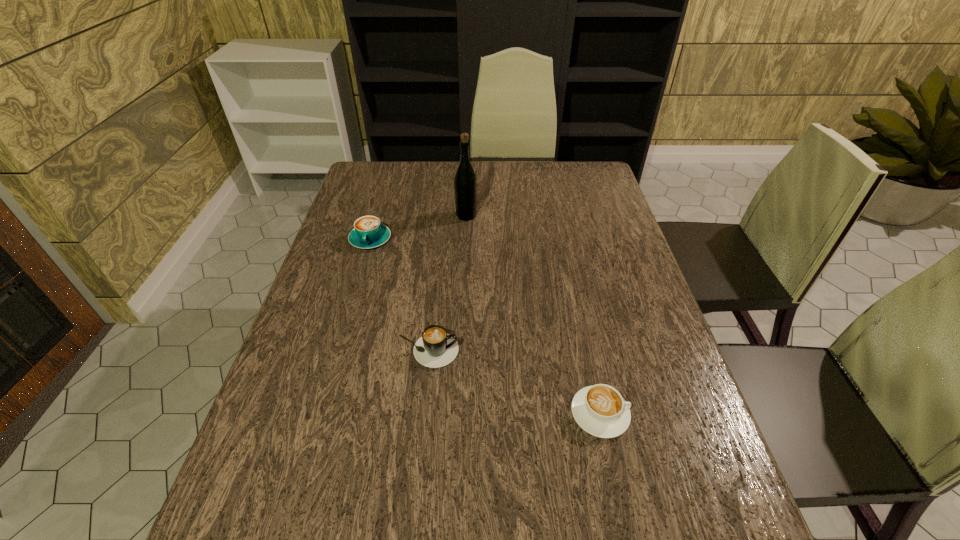
Image resolution: width=960 pixels, height=540 pixels. In order to click on cappuccino that is the nearest to the rightmost cappuccino in this screenshot , I will do `click(436, 348)`.

Locate an element on the screen. The image size is (960, 540). the closest cappuccino to the leftmost object is located at coordinates pyautogui.click(x=436, y=348).